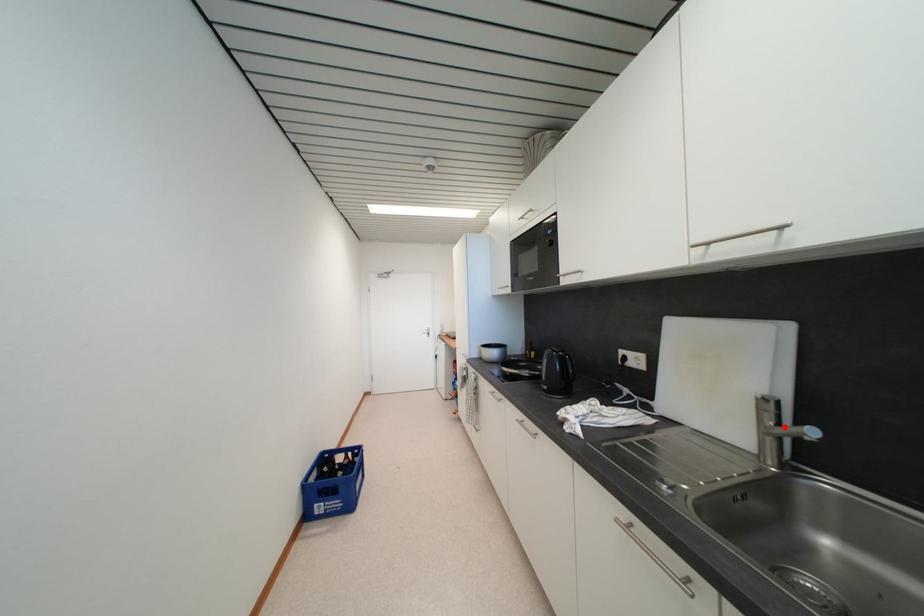
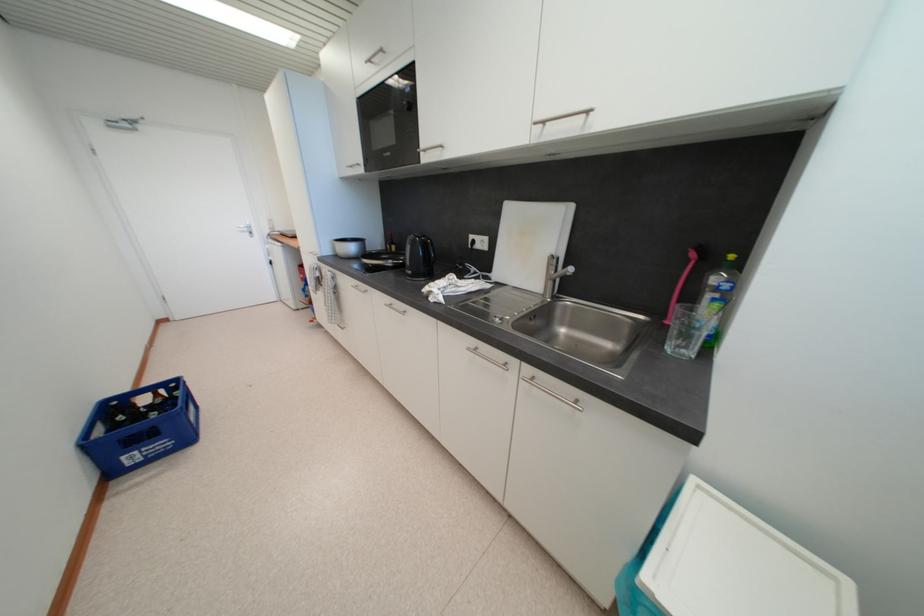
Locate, in the second image, the point that corresponds to the highlighted location in the first image.

(561, 275)